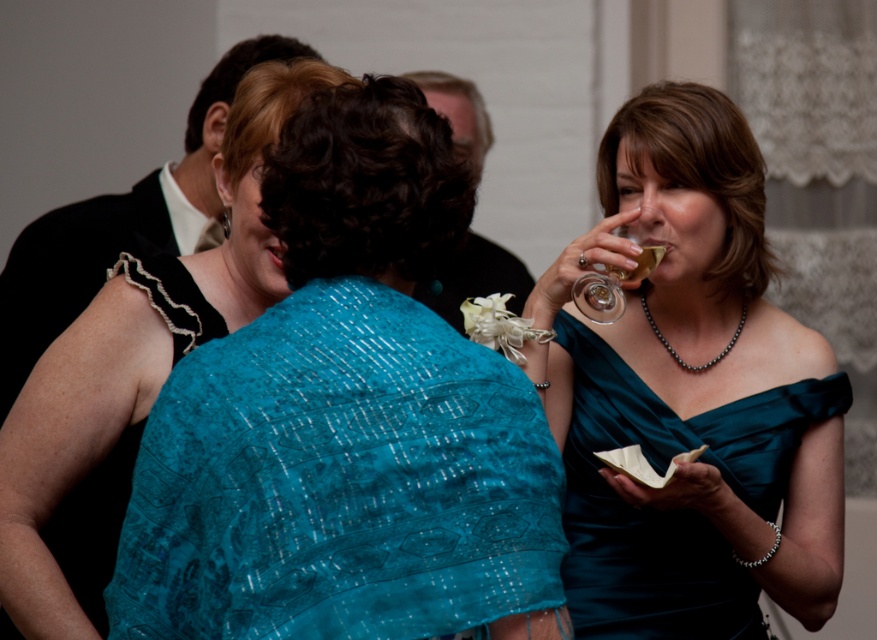
You are at a formal event and want to greet the person wearing the teal satin dress at center and the teal satin dress at right. Which one should you approach first if you want to speak to the one closer to you?

The teal satin dress at center is closer to you because it is in front of the teal satin dress at right, so you should approach the teal satin dress at center first.

From the picture: You are a photographer at a formal event. You need to capture a photo of the teal lace shawl at center and the teal satin dress at right. Which object should you zoom in on to ensure it takes up more space in your photo?

The teal lace shawl at center is larger in size than the teal satin dress at right, so you should zoom in on the teal lace shawl at center to ensure it takes up more space in your photo.

You are a photographer at the event and want to capture a photo of the teal satin dress at center and the translucent glass at upper right. Since the dress is wider than the glass, where should you position your camera to ensure both are fully visible in the frame?

Position the camera so that the teal satin dress at center is centered and the translucent glass at upper right is placed to its right side. Since the teal satin dress at center is wider than the translucent glass at upper right, this arrangement ensures both fit within the frame without cropping either object.